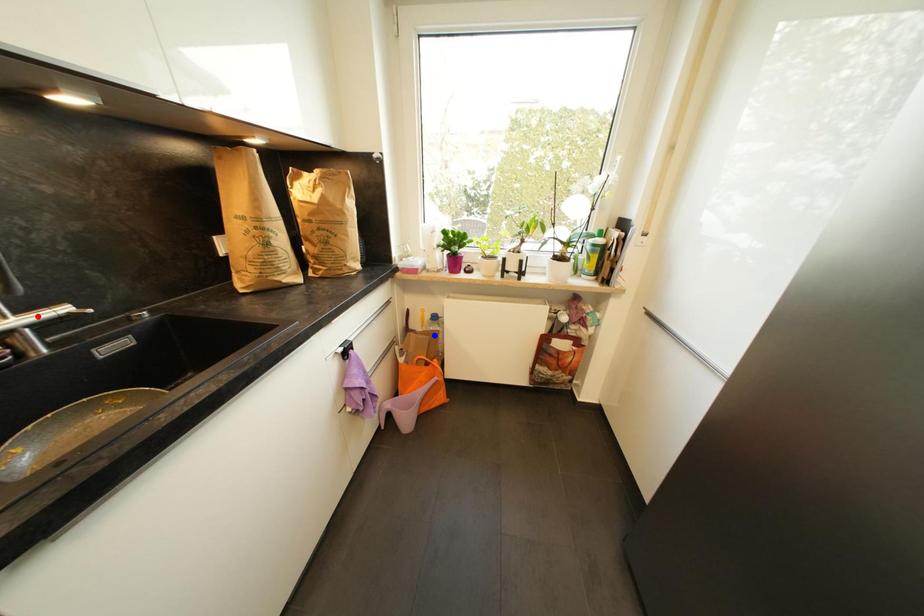
Question: In the image, two points are highlighted. Which point is nearer to the camera? Reply with the corresponding letter.

Choices:
 (A) blue point
 (B) red point

Answer: (B)